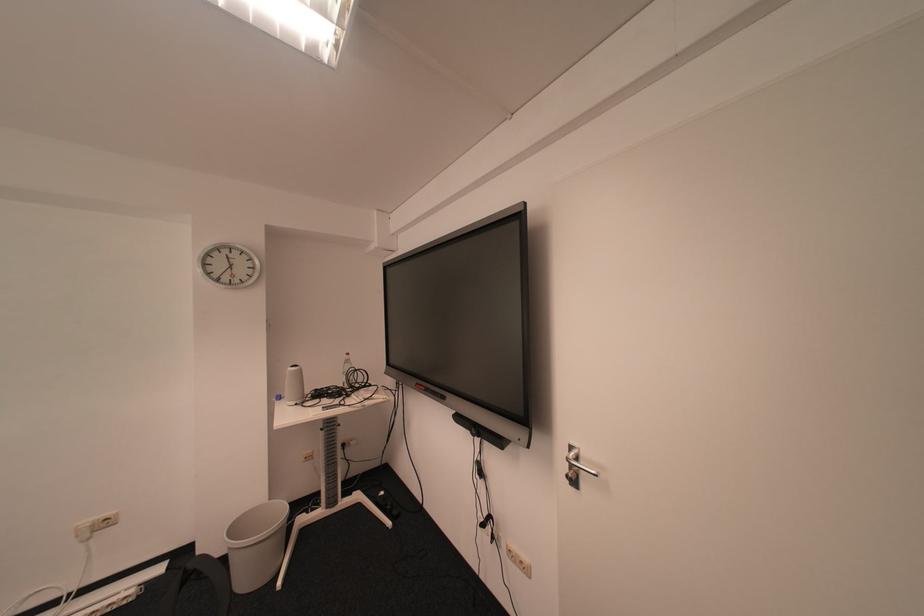
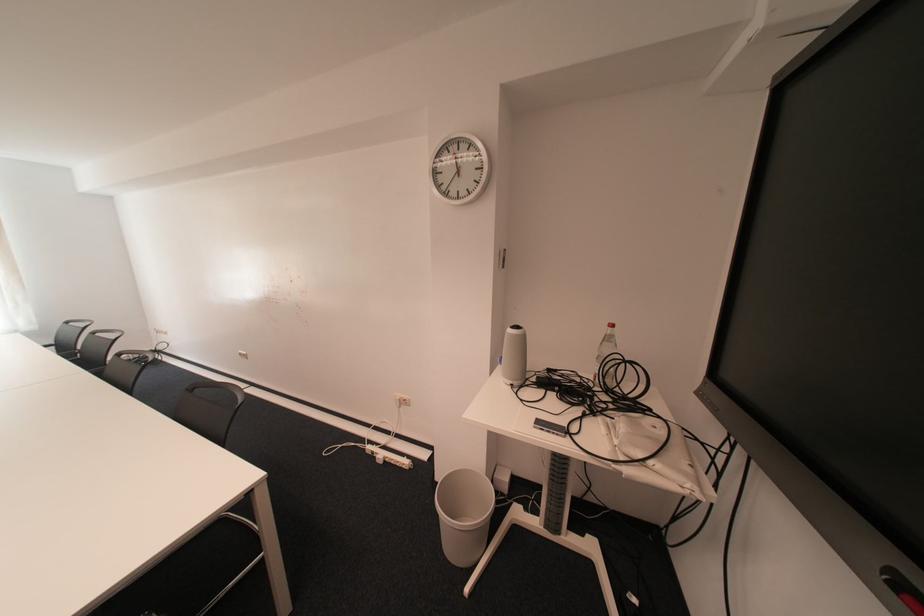
Where in the second image is the point corresponding to point 228,281 from the first image?

(457, 195)